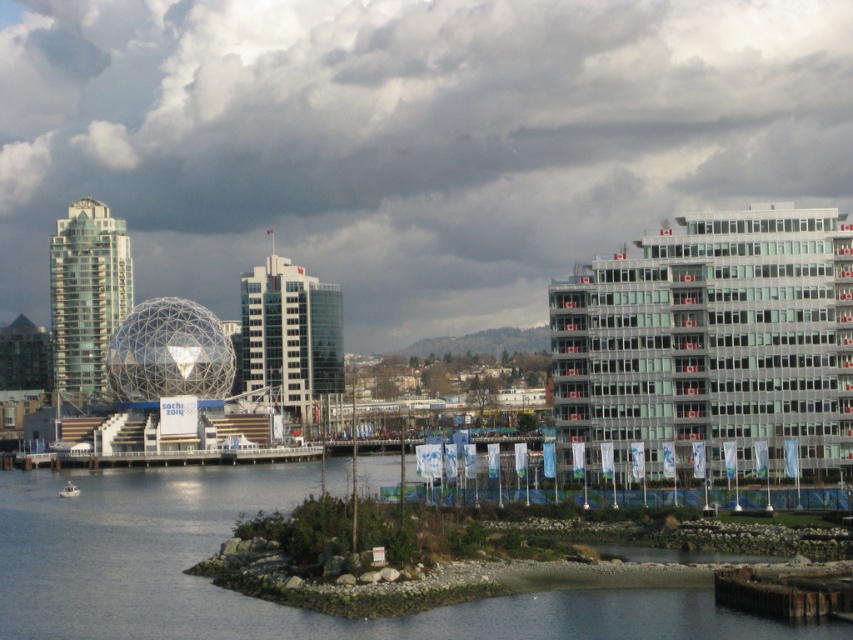
Question: Which object is farther from the camera taking this photo?

Choices:
 (A) white plastic boat at lower left
 (B) blue water at lower left

Answer: (A)

Question: Does blue water at lower left lie behind white plastic boat at lower left?

Choices:
 (A) no
 (B) yes

Answer: (A)

Question: Considering the relative positions of white fluffy cloud at upper center and blue water at lower left in the image provided, where is white fluffy cloud at upper center located with respect to blue water at lower left?

Choices:
 (A) above
 (B) below

Answer: (A)

Question: Can you confirm if white fluffy cloud at upper center is positioned below white plastic boat at lower left?

Choices:
 (A) yes
 (B) no

Answer: (B)

Question: Which object appears farthest from the camera in this image?

Choices:
 (A) white fluffy cloud at upper center
 (B) white plastic boat at lower left
 (C) blue water at lower left

Answer: (A)

Question: Considering the real-world distances, which object is farthest from the blue water at lower left?

Choices:
 (A) white fluffy cloud at upper center
 (B) white plastic boat at lower left

Answer: (A)